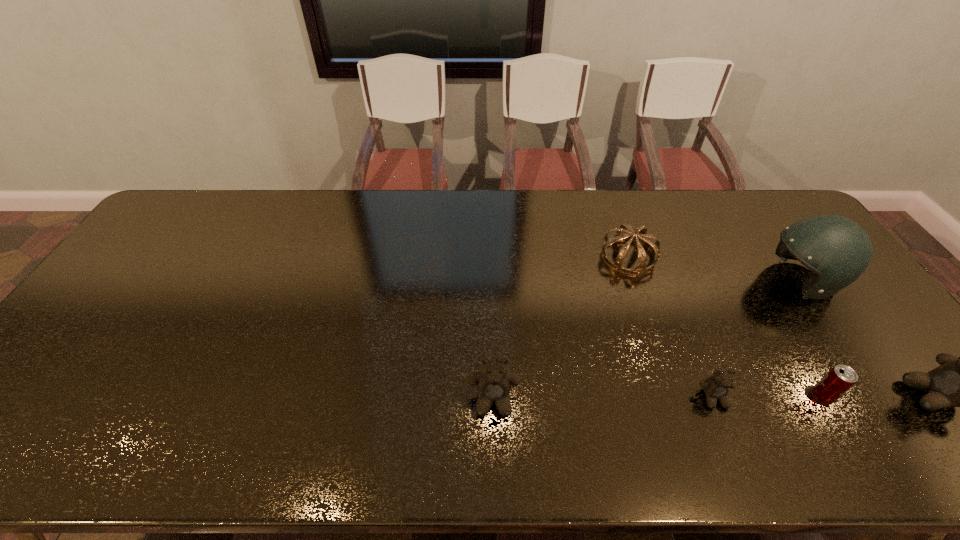
The height and width of the screenshot is (540, 960). I want to click on vacant space in between the third object from right to left and the second teddy bear from left to right, so click(768, 397).

Locate an element on the screen. This screenshot has width=960, height=540. free space that is in between the football helmet and the second tallest teddy bear is located at coordinates (647, 340).

Find the location of a particular element. free space between the football helmet and the leftmost object is located at coordinates (647, 340).

Where is `free space that is in between the tallest object and the tiara`? The height and width of the screenshot is (540, 960). free space that is in between the tallest object and the tiara is located at coordinates (714, 268).

At what (x,y) coordinates should I click in order to perform the action: click on object identified as the fifth closest to the tiara. Please return your answer as a coordinate pair (x, y). The image size is (960, 540). Looking at the image, I should click on (959, 381).

Locate an element on the screen. The image size is (960, 540). object that can be found as the fourth closest to the tiara is located at coordinates (493, 382).

Identify which teddy bear is the closest to the fourth tallest object. Please provide its 2D coordinates. Your answer should be formatted as a tuple, i.e. [(x, y)], where the tuple contains the x and y coordinates of a point satisfying the conditions above.

[(716, 387)]

Select which teddy bear appears as the third closest to the third shortest object. Please provide its 2D coordinates. Your answer should be formatted as a tuple, i.e. [(x, y)], where the tuple contains the x and y coordinates of a point satisfying the conditions above.

[(959, 381)]

Locate an element on the screen. vacant space that satisfies the following two spatial constraints: 1. at the face opening of the tallest object; 2. on the front side of the beer can is located at coordinates click(x=881, y=396).

Where is `vacant area in the image that satisfies the following two spatial constraints: 1. at the face opening of the football helmet; 2. on the face of the leftmost object`? vacant area in the image that satisfies the following two spatial constraints: 1. at the face opening of the football helmet; 2. on the face of the leftmost object is located at coordinates (883, 400).